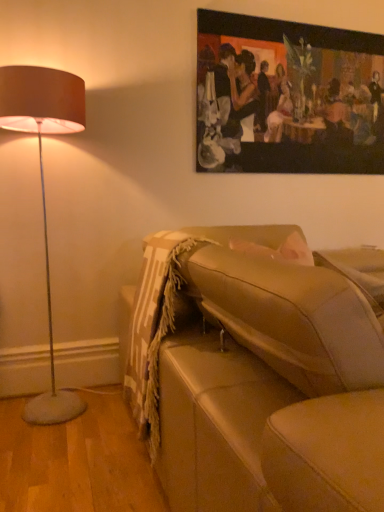
Locate an element on the screen. free point above oil painting at upper center (from a real-world perspective) is located at coordinates (293, 19).